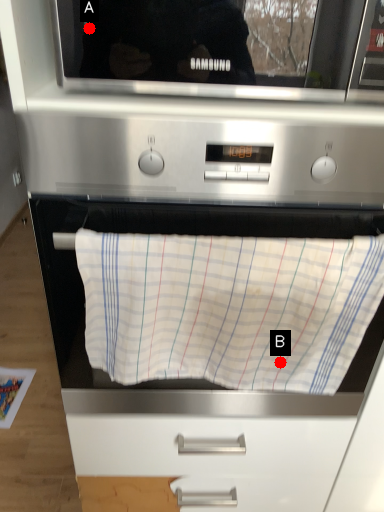
Question: Two points are circled on the image, labeled by A and B beside each circle. Among these points, which one is farthest from the camera?

Choices:
 (A) A is further
 (B) B is further

Answer: (B)